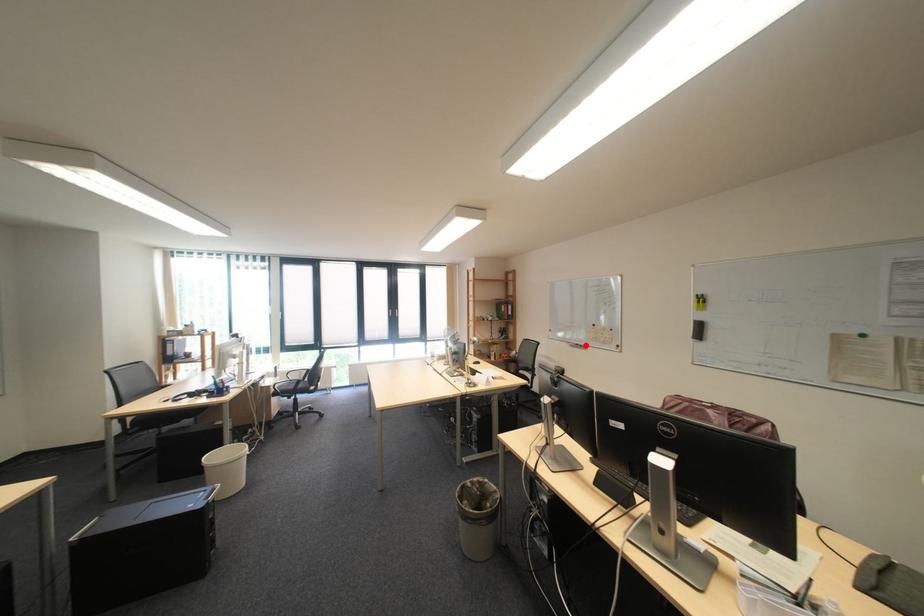
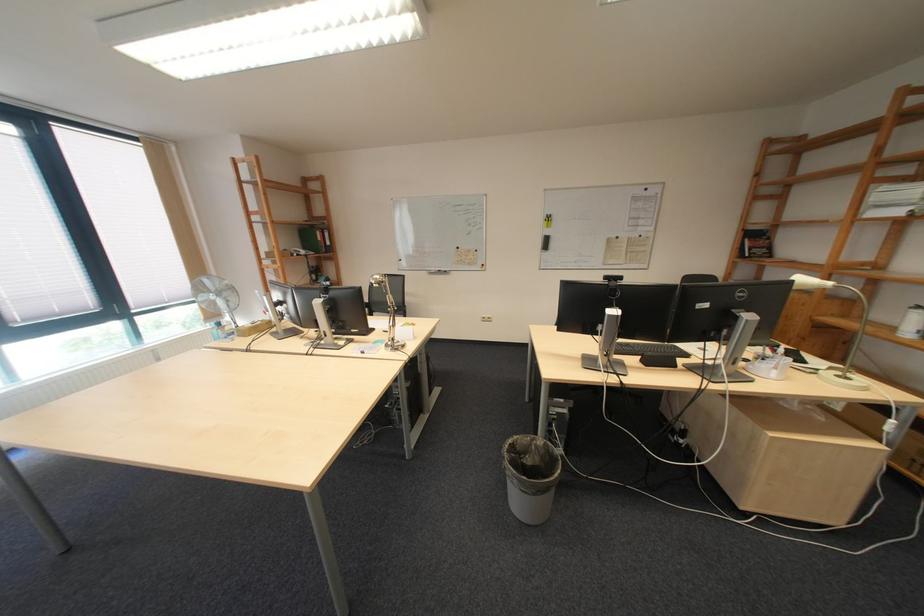
The point at the highlighted location is marked in the first image. Where is the corresponding point in the second image?

(446, 273)